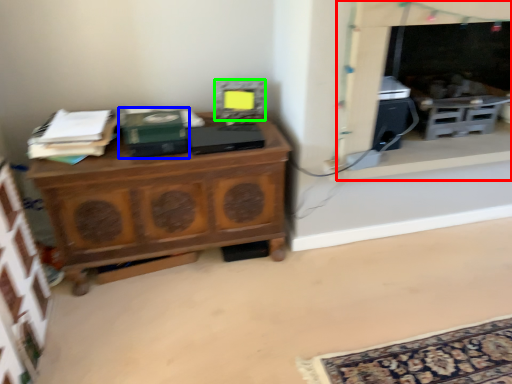
Question: Which is nearer to the fireplace (highlighted by a red box)? book (highlighted by a blue box) or appliance (highlighted by a green box).

Choices:
 (A) book
 (B) appliance

Answer: (B)